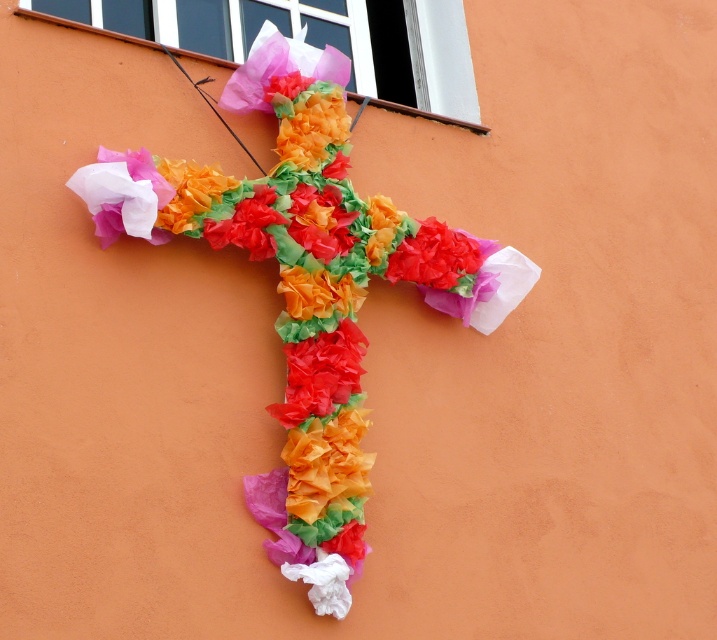
Measure the distance between tissue paper cross at center and matte paper flower at center.

14.57 inches

Which is behind, point (229, 189) or point (447, 237)?

The point (447, 237) is behind.

This screenshot has height=640, width=717. Find the location of `tissue paper cross at center`. tissue paper cross at center is located at coordinates click(x=285, y=289).